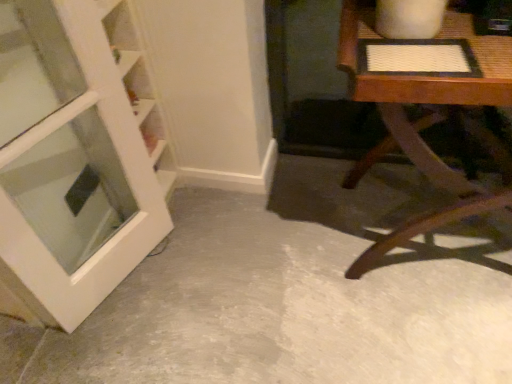
Measure the distance between wooden textured table at right and camera.

wooden textured table at right and camera are 31.19 inches apart from each other.

What do you see at coordinates (75, 158) in the screenshot? The height and width of the screenshot is (384, 512). I see `white glossy door at left` at bounding box center [75, 158].

Looking at this image, in order to face white glossy door at left, should I rotate leftwards or rightwards?

To face it directly, rotate left by 22.520 degrees.

At what (x,y) coordinates should I click in order to perform the action: click on wooden textured table at right. Please return your answer as a coordinate pair (x, y). The image size is (512, 384). Looking at the image, I should click on (430, 112).

From the image's perspective, is white glossy door at left positioned above or below wooden textured table at right?

white glossy door at left is below wooden textured table at right.

Is white glossy door at left oriented away from wooden textured table at right?

No.

Considering the sizes of objects white glossy door at left and wooden textured table at right in the image provided, who is bigger, white glossy door at left or wooden textured table at right?

Bigger between the two is wooden textured table at right.

Which is behind, point (455, 81) or point (457, 351)?

Positioned behind is point (457, 351).

Is wooden textured table at right positioned in front of gray concrete floor at center?

Yes, it is in front of gray concrete floor at center.

Is wooden textured table at right inside or outside of gray concrete floor at center?

wooden textured table at right is located beyond the bounds of gray concrete floor at center.

From a real-world perspective, between gray concrete floor at center and wooden textured table at right, who is vertically higher?

wooden textured table at right.

Does gray concrete floor at center have a lesser width compared to wooden textured table at right?

Incorrect, the width of gray concrete floor at center is not less than that of wooden textured table at right.

From the image's perspective, is gray concrete floor at center located beneath wooden textured table at right?

Indeed, from the image's perspective, gray concrete floor at center is shown beneath wooden textured table at right.

How many degrees apart are the facing directions of gray concrete floor at center and wooden textured table at right?

3.3 degrees.

Is the position of wooden textured table at right less distant than that of white glossy door at left?

No, it is not.

Which of these two, wooden textured table at right or white glossy door at left, is smaller?

white glossy door at left.

Is wooden textured table at right in contact with white glossy door at left?

They are not placed beside each other.

From a real-world perspective, which object stands above the other?

white glossy door at left.

Based on the photo, from the image's perspective, which one is positioned lower, white glossy door at left or gray concrete floor at center?

gray concrete floor at center is shown below in the image.

The height and width of the screenshot is (384, 512). In order to click on door located in front of the gray concrete floor at center in this screenshot , I will do `click(75, 158)`.

Is white glossy door at left completely or partially outside of gray concrete floor at center?

Yes, white glossy door at left is outside of gray concrete floor at center.

From the picture: From a real-world perspective, is gray concrete floor at center over white glossy door at left?

No.

Can you confirm if gray concrete floor at center is shorter than white glossy door at left?

Yes.

Is gray concrete floor at center bigger or smaller than white glossy door at left?

Considering their sizes, gray concrete floor at center takes up more space than white glossy door at left.

In order to click on door lying in front of the wooden textured table at right in this screenshot , I will do `click(75, 158)`.

In the image, there is a wooden textured table at right. At what (x,y) coordinates should I click in order to perform the action: click on concrete below it (from the image's perspective). Please return your answer as a coordinate pair (x, y). The width and height of the screenshot is (512, 384). Looking at the image, I should click on (291, 295).

Based on their spatial positions, is wooden textured table at right or gray concrete floor at center closer to white glossy door at left?

Based on the image, gray concrete floor at center appears to be nearer to white glossy door at left.

When comparing their distances from gray concrete floor at center, does wooden textured table at right or white glossy door at left seem further?

Among the two, white glossy door at left is located further to gray concrete floor at center.

Based on their spatial positions, is gray concrete floor at center or white glossy door at left further from wooden textured table at right?

white glossy door at left is positioned further to the anchor wooden textured table at right.

Based on their spatial positions, is white glossy door at left or wooden textured table at right closer to gray concrete floor at center?

wooden textured table at right lies closer to gray concrete floor at center than the other object.

Based on their spatial positions, is white glossy door at left or gray concrete floor at center further from wooden textured table at right?

white glossy door at left lies further to wooden textured table at right than the other object.

Looking at the image, which one is located closer to white glossy door at left, gray concrete floor at center or wooden textured table at right?

Among the two, gray concrete floor at center is located nearer to white glossy door at left.

Identify the location of concrete situated between white glossy door at left and wooden textured table at right from left to right. The height and width of the screenshot is (384, 512). (291, 295).